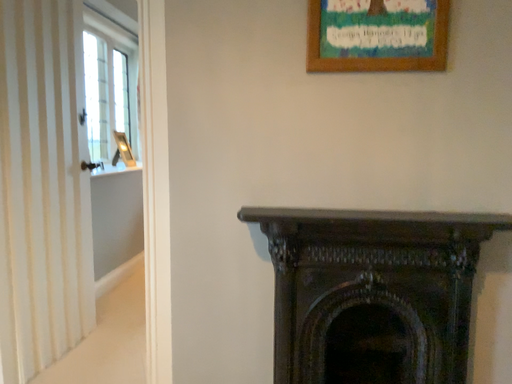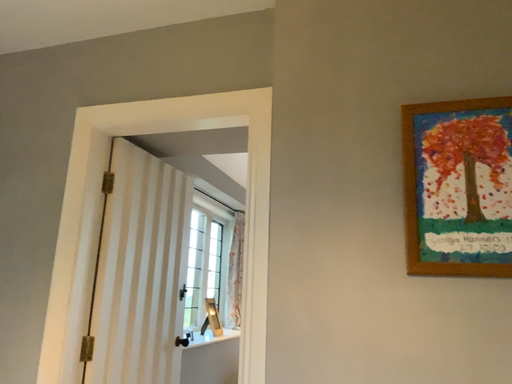
Question: Which way did the camera rotate in the video?

Choices:
 (A) rotated downward
 (B) rotated upward

Answer: (B)